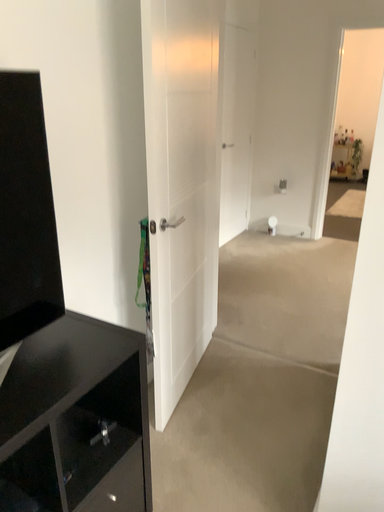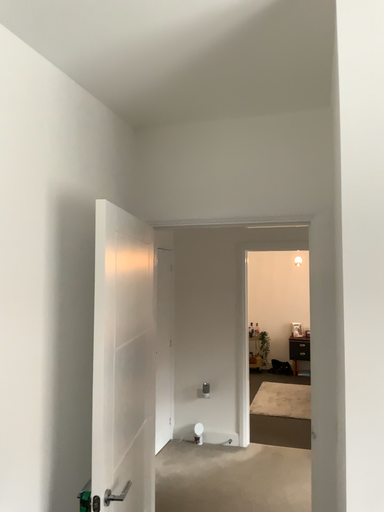
Question: How did the camera likely rotate when shooting the video?

Choices:
 (A) rotated downward
 (B) rotated upward

Answer: (B)